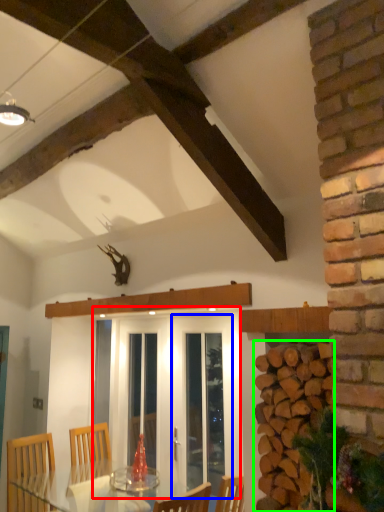
Question: Considering the real-world distances, which object is farthest from screen door (highlighted by a red box)? screen door (highlighted by a blue box) or brickwork (highlighted by a green box)?

Choices:
 (A) screen door
 (B) brickwork

Answer: (B)